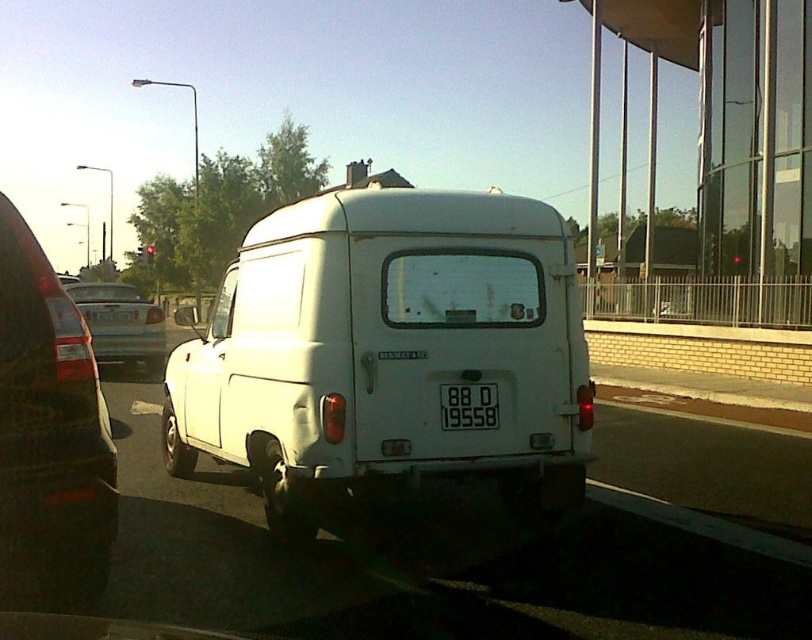
Question: Which of these objects is positioned farthest from the matte black van at left?

Choices:
 (A) silver metallic sedan at center-left
 (B) black plastic license plate at center
 (C) white matte van at center

Answer: (A)

Question: Does white matte van at center have a lesser width compared to matte black van at left?

Choices:
 (A) yes
 (B) no

Answer: (A)

Question: Does white matte van at center appear on the left side of matte black van at left?

Choices:
 (A) yes
 (B) no

Answer: (B)

Question: Among these points, which one is nearest to the camera?

Choices:
 (A) (106, 298)
 (B) (437, 371)
 (C) (482, 397)

Answer: (B)

Question: Observing the image, what is the correct spatial positioning of silver metallic sedan at center-left in reference to black plastic license plate at center?

Choices:
 (A) left
 (B) right

Answer: (A)

Question: Which of the following is the farthest from the observer?

Choices:
 (A) white matte van at center
 (B) black plastic license plate at center
 (C) matte black van at left
 (D) silver metallic sedan at center-left

Answer: (D)